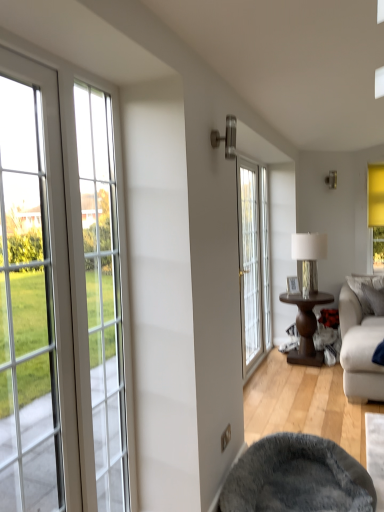
Question: From the image's perspective, is metallic silver lamp at center-right positioned above or below white glass door at center?

Choices:
 (A) above
 (B) below

Answer: (A)

Question: In the image, is metallic silver lamp at center-right positioned in front of or behind white glass door at center?

Choices:
 (A) front
 (B) behind

Answer: (B)

Question: Based on their relative distances, which object is farther from the wooden picture frame at center?

Choices:
 (A) gray plush bean bag chair at lower center
 (B) brown wooden table at center-right
 (C) white fabric couch at lower right
 (D) white glass door at center
 (E) metallic silver lamp at center-right

Answer: (A)

Question: Based on their relative distances, which object is nearer to the gray fabric pillow at right?

Choices:
 (A) white glass door at center
 (B) brown wooden table at center-right
 (C) metallic silver lamp at center-right
 (D) gray plush bean bag chair at lower center
 (E) wooden picture frame at center

Answer: (B)